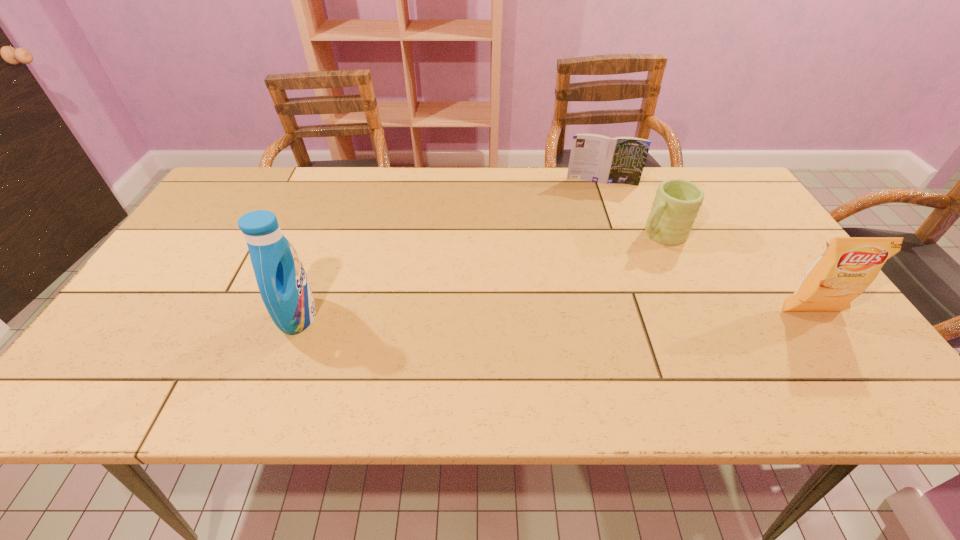
Locate an element on the screen. vacant area at the right edge of the desktop is located at coordinates pos(737,214).

Locate an element on the screen. The width and height of the screenshot is (960, 540). vacant space at the far left corner is located at coordinates coord(262,173).

Image resolution: width=960 pixels, height=540 pixels. Find the location of `empty space that is in between the third shortest object and the mug`. empty space that is in between the third shortest object and the mug is located at coordinates (735, 273).

This screenshot has width=960, height=540. What are the coordinates of `free space between the third nearest object and the detergent` in the screenshot? It's located at (479, 275).

Where is `free space between the mug and the leftmost object`? This screenshot has height=540, width=960. free space between the mug and the leftmost object is located at coordinates (479, 275).

This screenshot has height=540, width=960. Identify the location of vacant space that is in between the detergent and the book. (450, 249).

Find the location of a particular element. vacant space that is in between the third shortest object and the detergent is located at coordinates (555, 314).

Where is `empty space that is in between the detergent and the mug`? The height and width of the screenshot is (540, 960). empty space that is in between the detergent and the mug is located at coordinates (479, 275).

Image resolution: width=960 pixels, height=540 pixels. In order to click on vacant area between the second farthest object and the farthest object in this screenshot , I will do `click(631, 208)`.

Locate an element on the screen. vacant area between the leftmost object and the crisp (potato chip) is located at coordinates (555, 314).